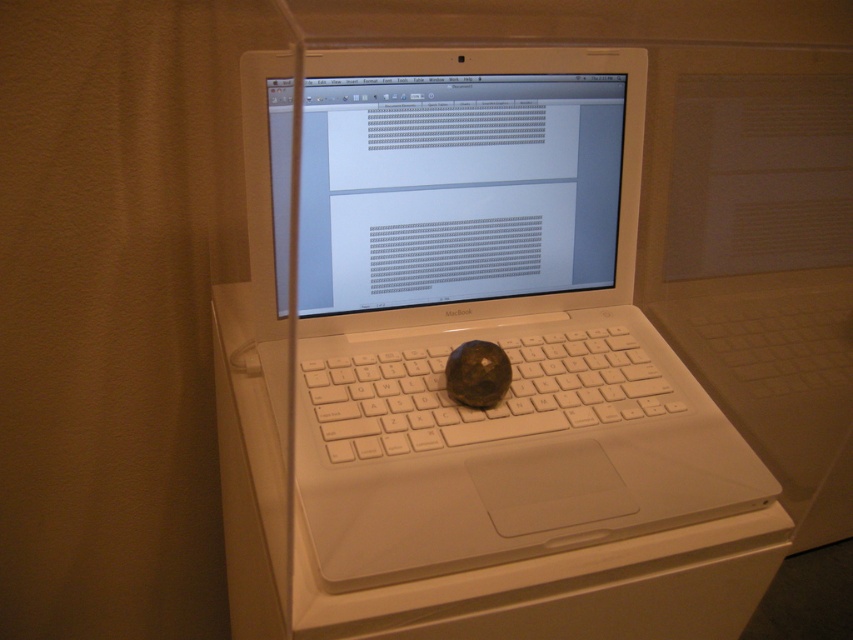
Question: Does white plastic laptop at center come behind white plastic keyboard at center?

Choices:
 (A) no
 (B) yes

Answer: (A)

Question: Which point is farther from the camera taking this photo?

Choices:
 (A) (659, 410)
 (B) (335, 99)

Answer: (A)

Question: Does white plastic laptop at center have a smaller size compared to white plastic keyboard at center?

Choices:
 (A) yes
 (B) no

Answer: (B)

Question: Is white plastic laptop at center thinner than white plastic keyboard at center?

Choices:
 (A) no
 (B) yes

Answer: (A)

Question: Which of the following is the closest to the observer?

Choices:
 (A) white plastic laptop at center
 (B) white plastic keyboard at center

Answer: (A)

Question: Which point is closer to the camera?

Choices:
 (A) white plastic keyboard at center
 (B) white plastic laptop at center

Answer: (B)